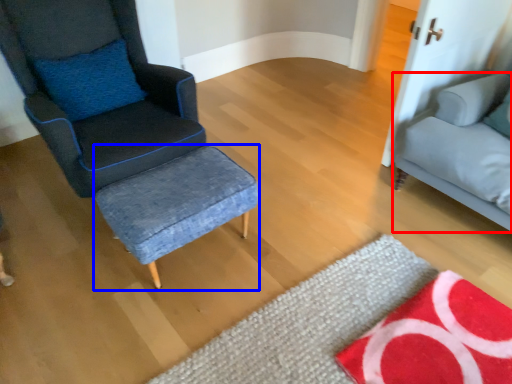
Question: Which point is further to the camera, studio couch (highlighted by a red box) or stool (highlighted by a blue box)?

Choices:
 (A) studio couch
 (B) stool

Answer: (B)